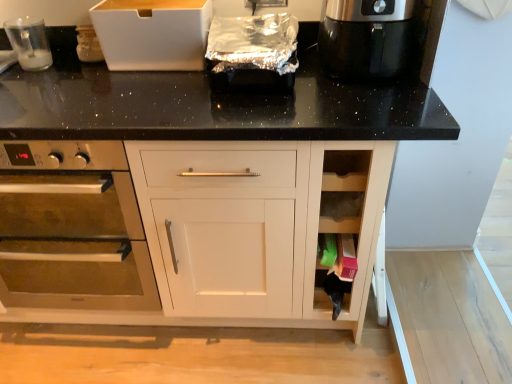
Question: Choose the correct answer: Is shiny black coffee maker at upper right inside stainless steel oven at left or outside it?

Choices:
 (A) outside
 (B) inside

Answer: (A)

Question: Looking at their shapes, would you say shiny black coffee maker at upper right is wider or thinner than stainless steel oven at left?

Choices:
 (A) wide
 (B) thin

Answer: (B)

Question: Which of these objects is positioned closest to the shiny black coffee maker at upper right?

Choices:
 (A) white cardboard box at upper center
 (B) clear plastic cup at upper left
 (C) stainless steel oven at left

Answer: (A)

Question: Which object is positioned closest to the white cardboard box at upper center?

Choices:
 (A) shiny black coffee maker at upper right
 (B) clear plastic cup at upper left
 (C) stainless steel oven at left

Answer: (B)